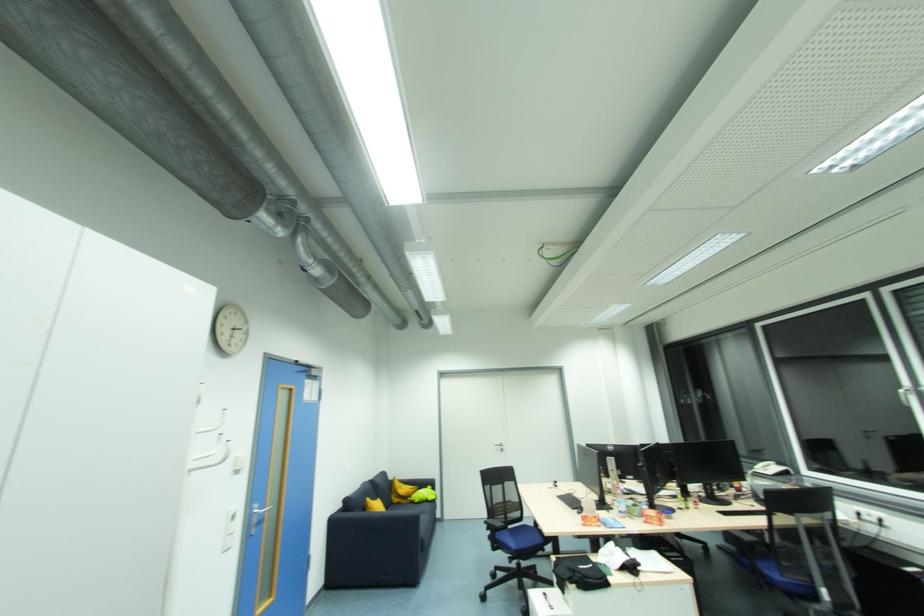
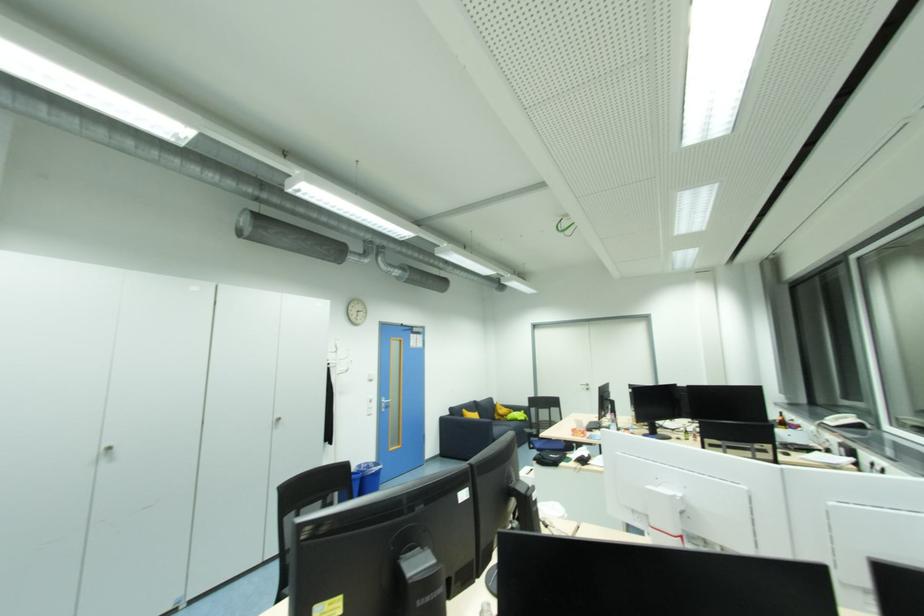
Where in the second image is the point corresponding to (367,511) from the first image?

(466, 416)